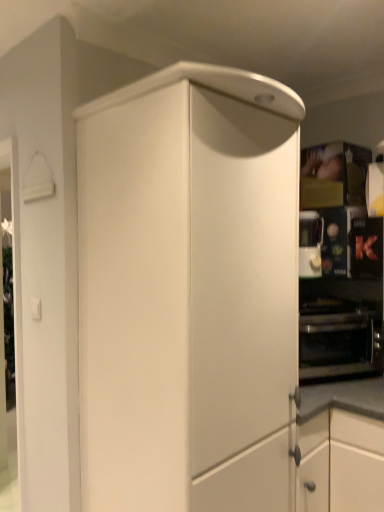
The image size is (384, 512). What do you see at coordinates (366, 248) in the screenshot?
I see `black matte oven at right` at bounding box center [366, 248].

What do you see at coordinates (188, 291) in the screenshot?
I see `matte white cabinet at center` at bounding box center [188, 291].

What do you see at coordinates (339, 342) in the screenshot?
I see `black metallic oven at right` at bounding box center [339, 342].

Locate an element on the screen. black metallic oven at right is located at coordinates (339, 342).

Locate an element on the screen. The image size is (384, 512). satin silver coffee machine at right is located at coordinates (310, 244).

How much distance is there between matte white cabinet at center and black matte oven at right?

A distance of 39.12 inches exists between matte white cabinet at center and black matte oven at right.

From the image's perspective, is matte white cabinet at center on black matte oven at right?

Incorrect, from the image's perspective, matte white cabinet at center is lower than black matte oven at right.

Are matte white cabinet at center and black matte oven at right located far from each other?

That's not correct — matte white cabinet at center is a little close to black matte oven at right.

Looking at this image, who is shorter, matte white cabinet at center or black matte oven at right?

black matte oven at right.

Is black metallic oven at right located within satin silver coffee machine at right?

No, black metallic oven at right is not surrounded by satin silver coffee machine at right.

Would you consider satin silver coffee machine at right to be distant from black metallic oven at right?

satin silver coffee machine at right is actually quite close to black metallic oven at right.

Which point is more forward, (299, 270) or (309, 308)?

The point (299, 270) is closer.

Which object is more forward, satin silver coffee machine at right or black metallic oven at right?

black metallic oven at right is in front.

Does point (368, 329) come behind point (316, 216)?

No.

Can satin silver coffee machine at right be found inside black metallic oven at right?

No, satin silver coffee machine at right is not inside black metallic oven at right.

Is black metallic oven at right thinner than satin silver coffee machine at right?

No.

Which is nearer, (336, 356) or (349, 245)?

Point (336, 356)

Measure the distance from black metallic oven at right to black matte oven at right.

A distance of 12.74 inches exists between black metallic oven at right and black matte oven at right.

What's the angular difference between black metallic oven at right and black matte oven at right's facing directions?

62.9 degrees separate the facing orientations of black metallic oven at right and black matte oven at right.

Where is `appliance that is on the right side of black metallic oven at right`? The width and height of the screenshot is (384, 512). appliance that is on the right side of black metallic oven at right is located at coordinates (366, 248).

From the picture: Is matte white cabinet at center bigger than black metallic oven at right?

Indeed, matte white cabinet at center has a larger size compared to black metallic oven at right.

Is matte white cabinet at center oriented towards black metallic oven at right?

No, matte white cabinet at center does not turn towards black metallic oven at right.

From the image's perspective, is matte white cabinet at center on black metallic oven at right?

Indeed, from the image's perspective, matte white cabinet at center is shown above black metallic oven at right.

In the image, there is a matte white cabinet at center. At what (x,y) coordinates should I click in order to perform the action: click on oven below it (from the image's perspective). Please return your answer as a coordinate pair (x, y). This screenshot has height=512, width=384. Looking at the image, I should click on (339, 342).

Find the location of a particular element. This screenshot has width=384, height=512. appliance on the right of satin silver coffee machine at right is located at coordinates (366, 248).

Is satin silver coffee machine at right far from black matte oven at right?

satin silver coffee machine at right is near black matte oven at right, not far away.

Which object is wider, satin silver coffee machine at right or black matte oven at right?

With larger width is satin silver coffee machine at right.

Is point (381, 241) closer to viewer compared to point (315, 234)?

Yes, it is.

Does black matte oven at right lie in front of satin silver coffee machine at right?

Yes, black matte oven at right is in front of satin silver coffee machine at right.

Can you tell me how much black matte oven at right and satin silver coffee machine at right differ in facing direction?

59.4 degrees separate the facing orientations of black matte oven at right and satin silver coffee machine at right.

Is satin silver coffee machine at right surrounded by black matte oven at right?

No, satin silver coffee machine at right is not a part of black matte oven at right.

The image size is (384, 512). What are the coordinates of `cabinetry below the black matte oven at right (from a real-world perspective)` in the screenshot? It's located at (188, 291).

This screenshot has width=384, height=512. Find the location of `coffee machine that appears above the black metallic oven at right (from a real-world perspective)`. coffee machine that appears above the black metallic oven at right (from a real-world perspective) is located at coordinates (310, 244).

When comparing their distances from black matte oven at right, does satin silver coffee machine at right or black metallic oven at right seem closer?

Based on the image, satin silver coffee machine at right appears to be nearer to black matte oven at right.

From the image, which object appears to be farther from matte white cabinet at center, black metallic oven at right or satin silver coffee machine at right?

satin silver coffee machine at right is further to matte white cabinet at center.

Estimate the real-world distances between objects in this image. Which object is closer to black matte oven at right, satin silver coffee machine at right or matte white cabinet at center?

satin silver coffee machine at right.

Based on their spatial positions, is satin silver coffee machine at right or black matte oven at right further from black metallic oven at right?

Among the two, satin silver coffee machine at right is located further to black metallic oven at right.

From the image, which object appears to be nearer to black matte oven at right, matte white cabinet at center or satin silver coffee machine at right?

satin silver coffee machine at right is closer to black matte oven at right.

Considering their positions, is satin silver coffee machine at right positioned closer to matte white cabinet at center than black matte oven at right?

Based on the image, satin silver coffee machine at right appears to be nearer to matte white cabinet at center.

Considering their positions, is black metallic oven at right positioned further to satin silver coffee machine at right than black matte oven at right?

black metallic oven at right is positioned further to the anchor satin silver coffee machine at right.

When comparing their distances from black matte oven at right, does black metallic oven at right or matte white cabinet at center seem closer?

black metallic oven at right is positioned closer to the anchor black matte oven at right.

The image size is (384, 512). Find the location of `oven between matte white cabinet at center and black matte oven at right from front to back`. oven between matte white cabinet at center and black matte oven at right from front to back is located at coordinates (339, 342).

I want to click on appliance between satin silver coffee machine at right and black metallic oven at right from top to bottom, so pos(366,248).

Where is `appliance between matte white cabinet at center and satin silver coffee machine at right along the z-axis`? Image resolution: width=384 pixels, height=512 pixels. appliance between matte white cabinet at center and satin silver coffee machine at right along the z-axis is located at coordinates (366, 248).

Identify the location of oven between matte white cabinet at center and satin silver coffee machine at right from front to back. Image resolution: width=384 pixels, height=512 pixels. (339, 342).